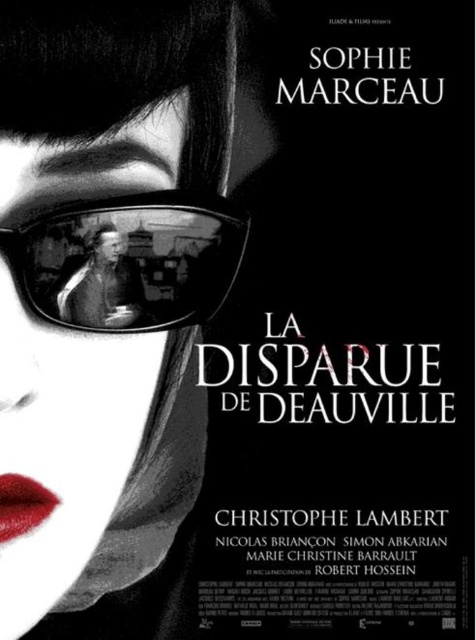
Question: Where is shiny reflective glasses at center located in relation to smooth plastic glasses at center in the image?

Choices:
 (A) right
 (B) left

Answer: (A)

Question: Can you confirm if smooth plastic glasses at center is positioned below shiny red lipstick at lower left?

Choices:
 (A) yes
 (B) no

Answer: (B)

Question: Among these objects, which one is farthest from the camera?

Choices:
 (A) smooth plastic glasses at center
 (B) shiny red lipstick at lower left

Answer: (B)

Question: Does shiny reflective glasses at center appear under smooth plastic glasses at center?

Choices:
 (A) no
 (B) yes

Answer: (A)

Question: Which object is positioned farthest from the shiny red lipstick at lower left?

Choices:
 (A) smooth plastic glasses at center
 (B) shiny reflective glasses at center

Answer: (B)

Question: Among these points, which one is nearest to the camera?

Choices:
 (A) (108, 280)
 (B) (0, 520)
 (C) (189, 220)

Answer: (B)